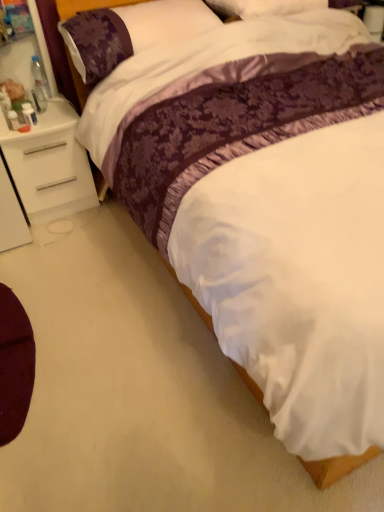
Question: From a real-world perspective, is white matte nightstand at left over maroon fabric cushion at lower left?

Choices:
 (A) yes
 (B) no

Answer: (A)

Question: Considering the relative sizes of white matte nightstand at left and maroon fabric cushion at lower left in the image provided, is white matte nightstand at left wider than maroon fabric cushion at lower left?

Choices:
 (A) yes
 (B) no

Answer: (A)

Question: Does white matte nightstand at left appear on the right side of maroon fabric cushion at lower left?

Choices:
 (A) no
 (B) yes

Answer: (A)

Question: Considering the relative positions of white matte nightstand at left and maroon fabric cushion at lower left in the image provided, is white matte nightstand at left to the left of maroon fabric cushion at lower left from the viewer's perspective?

Choices:
 (A) no
 (B) yes

Answer: (B)

Question: Is white matte nightstand at left positioned with its back to maroon fabric cushion at lower left?

Choices:
 (A) yes
 (B) no

Answer: (B)

Question: Is maroon fabric cushion at lower left inside white matte nightstand at left?

Choices:
 (A) no
 (B) yes

Answer: (A)

Question: Are maroon fabric cushion at lower left and plush brown bear at left far apart?

Choices:
 (A) no
 (B) yes

Answer: (B)

Question: Is maroon fabric cushion at lower left not within plush brown bear at left?

Choices:
 (A) no
 (B) yes

Answer: (B)

Question: Does maroon fabric cushion at lower left appear on the left side of plush brown bear at left?

Choices:
 (A) no
 (B) yes

Answer: (A)

Question: Is maroon fabric cushion at lower left oriented towards plush brown bear at left?

Choices:
 (A) no
 (B) yes

Answer: (A)

Question: Is maroon fabric cushion at lower left positioned with its back to plush brown bear at left?

Choices:
 (A) yes
 (B) no

Answer: (B)

Question: From a real-world perspective, is maroon fabric cushion at lower left located higher than plush brown bear at left?

Choices:
 (A) yes
 (B) no

Answer: (B)

Question: Is maroon fabric cushion at lower left with white matte nightstand at left?

Choices:
 (A) no
 (B) yes

Answer: (A)